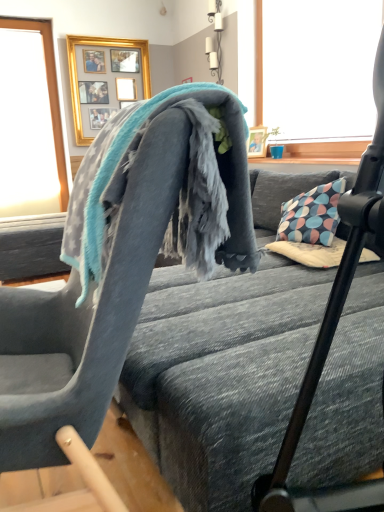
Image resolution: width=384 pixels, height=512 pixels. What do you see at coordinates (221, 375) in the screenshot?
I see `soft gray fabric bed frame at center` at bounding box center [221, 375].

Find the location of `gray fleece blanket at center`. gray fleece blanket at center is located at coordinates (180, 193).

In order to click on gold framed picture at upper center in this screenshot , I will do `click(77, 73)`.

Locate an element on the screen. The height and width of the screenshot is (512, 384). transparent glass window at upper left is located at coordinates (48, 92).

Measure the distance from transparent glass window at upper left to soft gray fabric bed frame at center.

transparent glass window at upper left is 11.30 feet from soft gray fabric bed frame at center.

From a real-world perspective, which is physically above, transparent glass window at upper left or soft gray fabric bed frame at center?

In real-world perspective, transparent glass window at upper left is above.

Which is more to the right, transparent glass window at upper left or soft gray fabric bed frame at center?

From the viewer's perspective, soft gray fabric bed frame at center appears more on the right side.

In the scene shown: Considering their positions, is transparent glass window at upper left located in front of or behind soft gray fabric bed frame at center?

transparent glass window at upper left is behind soft gray fabric bed frame at center.

Does gold framed picture at upper center have a smaller size compared to gray fleece blanket at center?

Yes.

Considering the positions of points (75, 75) and (107, 150), is point (75, 75) farther from camera compared to point (107, 150)?

That is True.

Is gold framed picture at upper center facing away from gray fleece blanket at center?

That's not correct — gold framed picture at upper center is not looking away from gray fleece blanket at center.

Can you tell me how much gold framed picture at upper center and gray fleece blanket at center differ in facing direction?

The facing directions of gold framed picture at upper center and gray fleece blanket at center are 97.2 degrees apart.

Considering the relative sizes of transparent glass window at upper left and soft gray fabric chair at upper center in the image provided, is transparent glass window at upper left bigger than soft gray fabric chair at upper center?

No.

From the image's perspective, is transparent glass window at upper left located beneath soft gray fabric chair at upper center?

No, from the image's perspective, transparent glass window at upper left is not beneath soft gray fabric chair at upper center.

Which object is positioned more to the right, transparent glass window at upper left or soft gray fabric chair at upper center?

soft gray fabric chair at upper center is more to the right.

What's the angular difference between transparent glass window at upper left and soft gray fabric chair at upper center's facing directions?

The angle between the facing direction of transparent glass window at upper left and the facing direction of soft gray fabric chair at upper center is 97.5 degrees.

Is soft gray fabric chair at upper center inside or outside of soft gray fabric bed frame at center?

soft gray fabric chair at upper center is outside soft gray fabric bed frame at center.

Where is `bed frame below the soft gray fabric chair at upper center (from a real-world perspective)`? bed frame below the soft gray fabric chair at upper center (from a real-world perspective) is located at coordinates (221, 375).

Considering the relative sizes of soft gray fabric chair at upper center and soft gray fabric bed frame at center in the image provided, is soft gray fabric chair at upper center taller than soft gray fabric bed frame at center?

Yes, soft gray fabric chair at upper center is taller than soft gray fabric bed frame at center.

From a real-world perspective, is soft gray fabric chair at upper center on soft gray fabric bed frame at center?

Yes, from a real-world perspective, soft gray fabric chair at upper center is on top of soft gray fabric bed frame at center.

Is gold framed picture at upper center bigger or smaller than soft gray fabric chair at upper center?

Clearly, gold framed picture at upper center is smaller in size than soft gray fabric chair at upper center.

From a real-world perspective, is gold framed picture at upper center above or below soft gray fabric chair at upper center?

Clearly, from a real-world perspective, gold framed picture at upper center is above soft gray fabric chair at upper center.

Is soft gray fabric chair at upper center inside gold framed picture at upper center?

Definitely not — soft gray fabric chair at upper center is not inside gold framed picture at upper center.

Which object is further away from the camera, gold framed picture at upper center or soft gray fabric chair at upper center?

Positioned behind is gold framed picture at upper center.

The image size is (384, 512). Find the location of `picture frame lying on the left of soft gray fabric chair at upper center`. picture frame lying on the left of soft gray fabric chair at upper center is located at coordinates (77, 73).

From a real-world perspective, who is located higher, soft gray fabric chair at upper center or gold framed picture at upper center?

gold framed picture at upper center.

Considering the relative sizes of soft gray fabric chair at upper center and gold framed picture at upper center in the image provided, is soft gray fabric chair at upper center bigger than gold framed picture at upper center?

Yes.

From the image's perspective, is soft gray fabric chair at upper center located beneath gold framed picture at upper center?

Yes, from the image's perspective, soft gray fabric chair at upper center is below gold framed picture at upper center.

Where is `bed frame to the right of gold framed picture at upper center`? bed frame to the right of gold framed picture at upper center is located at coordinates (221, 375).

Can you confirm if soft gray fabric bed frame at center is wider than gold framed picture at upper center?

Correct, the width of soft gray fabric bed frame at center exceeds that of gold framed picture at upper center.

Is gold framed picture at upper center surrounded by soft gray fabric bed frame at center?

No, gold framed picture at upper center is not surrounded by soft gray fabric bed frame at center.

From a real-world perspective, is soft gray fabric bed frame at center located beneath gold framed picture at upper center?

Yes.

Where is `window screen lying behind the soft gray fabric bed frame at center`? This screenshot has height=512, width=384. window screen lying behind the soft gray fabric bed frame at center is located at coordinates (48, 92).

Identify the location of bath towel lying on the right of gold framed picture at upper center. (180, 193).

Considering their positions, is soft gray fabric bed frame at center positioned closer to transparent glass window at upper left than gold framed picture at upper center?

Based on the image, gold framed picture at upper center appears to be nearer to transparent glass window at upper left.

When comparing their distances from soft gray fabric bed frame at center, does soft gray fabric chair at upper center or gray fleece blanket at center seem further?

Among the two, gray fleece blanket at center is located further to soft gray fabric bed frame at center.

From the image, which object appears to be nearer to gray fleece blanket at center, soft gray fabric bed frame at center or gold framed picture at upper center?

soft gray fabric bed frame at center is positioned closer to the anchor gray fleece blanket at center.

Estimate the real-world distances between objects in this image. Which object is further from soft gray fabric bed frame at center, gold framed picture at upper center or gray fleece blanket at center?

The object further to soft gray fabric bed frame at center is gold framed picture at upper center.

Estimate the real-world distances between objects in this image. Which object is closer to soft gray fabric chair at upper center, gray fleece blanket at center or transparent glass window at upper left?

gray fleece blanket at center.

Looking at the image, which one is located closer to gray fleece blanket at center, soft gray fabric chair at upper center or soft gray fabric bed frame at center?

soft gray fabric chair at upper center.

From the image, which object appears to be farther from transparent glass window at upper left, gold framed picture at upper center or gray fleece blanket at center?

gray fleece blanket at center lies further to transparent glass window at upper left than the other object.

Which object lies nearer to the anchor point soft gray fabric bed frame at center, gray fleece blanket at center or soft gray fabric chair at upper center?

soft gray fabric chair at upper center.

Find the location of a particular element. This screenshot has height=512, width=384. bath towel between soft gray fabric chair at upper center and gold framed picture at upper center from front to back is located at coordinates (180, 193).

What are the coordinates of `bath towel between soft gray fabric chair at upper center and soft gray fabric bed frame at center from left to right` in the screenshot? It's located at (180, 193).

Locate an element on the screen. The image size is (384, 512). bath towel positioned between soft gray fabric chair at upper center and transparent glass window at upper left from near to far is located at coordinates (180, 193).

This screenshot has width=384, height=512. What are the coordinates of `window screen between soft gray fabric chair at upper center and gold framed picture at upper center from front to back` in the screenshot? It's located at (48, 92).